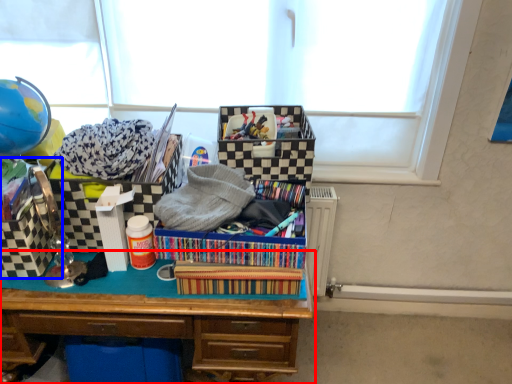
Question: Which point is closer to the camera, desk (highlighted by a red box) or storage box (highlighted by a blue box)?

Choices:
 (A) desk
 (B) storage box

Answer: (A)